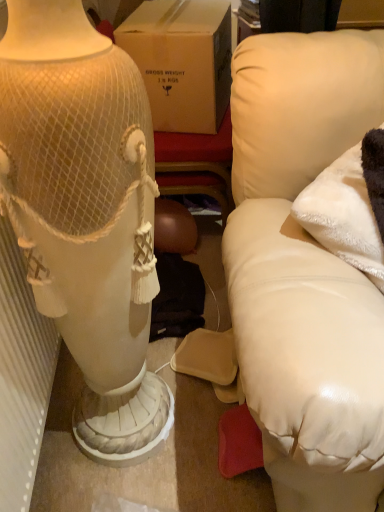
Question: Can you confirm if white textured radiator at left is thinner than white fluffy pillow at right?

Choices:
 (A) no
 (B) yes

Answer: (B)

Question: Is there a large distance between white textured radiator at left and white fluffy pillow at right?

Choices:
 (A) no
 (B) yes

Answer: (A)

Question: Is white textured radiator at left smaller than white fluffy pillow at right?

Choices:
 (A) yes
 (B) no

Answer: (B)

Question: Is the position of white textured radiator at left more distant than that of white fluffy pillow at right?

Choices:
 (A) yes
 (B) no

Answer: (B)

Question: From the image's perspective, is white textured radiator at left under white fluffy pillow at right?

Choices:
 (A) yes
 (B) no

Answer: (A)

Question: Is white fluffy pillow at right surrounded by white textured radiator at left?

Choices:
 (A) no
 (B) yes

Answer: (A)

Question: Does white textured radiator at left touch white leather couch at right?

Choices:
 (A) no
 (B) yes

Answer: (A)

Question: Could you tell me if white textured radiator at left is facing white leather couch at right?

Choices:
 (A) no
 (B) yes

Answer: (B)

Question: Does white textured radiator at left have a greater height compared to white leather couch at right?

Choices:
 (A) yes
 (B) no

Answer: (B)

Question: Can you confirm if white textured radiator at left is bigger than white leather couch at right?

Choices:
 (A) yes
 (B) no

Answer: (B)

Question: Is white textured radiator at left turned away from white leather couch at right?

Choices:
 (A) no
 (B) yes

Answer: (A)

Question: Does white textured radiator at left have a greater width compared to white leather couch at right?

Choices:
 (A) no
 (B) yes

Answer: (A)

Question: Can you confirm if white fluffy pillow at right is bigger than white leather couch at right?

Choices:
 (A) yes
 (B) no

Answer: (B)